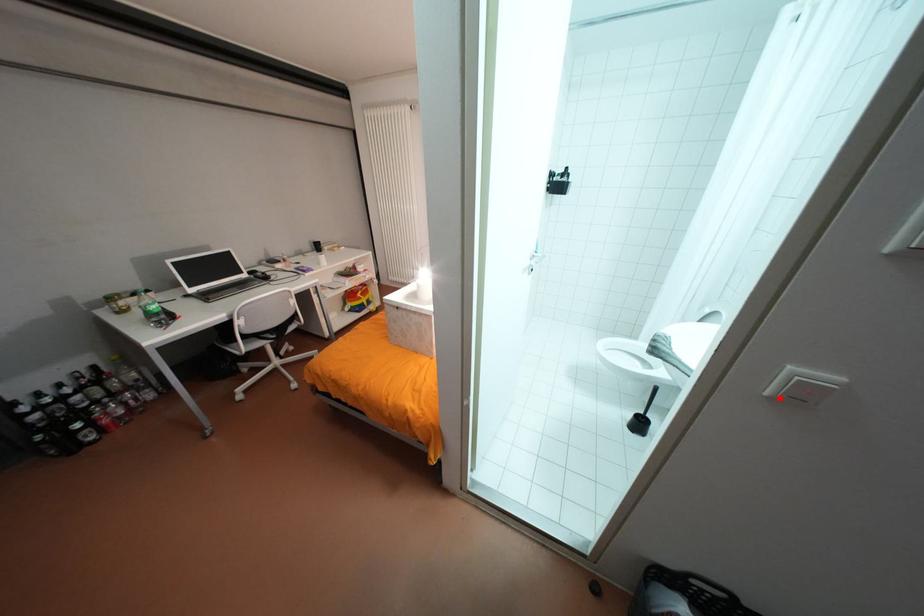
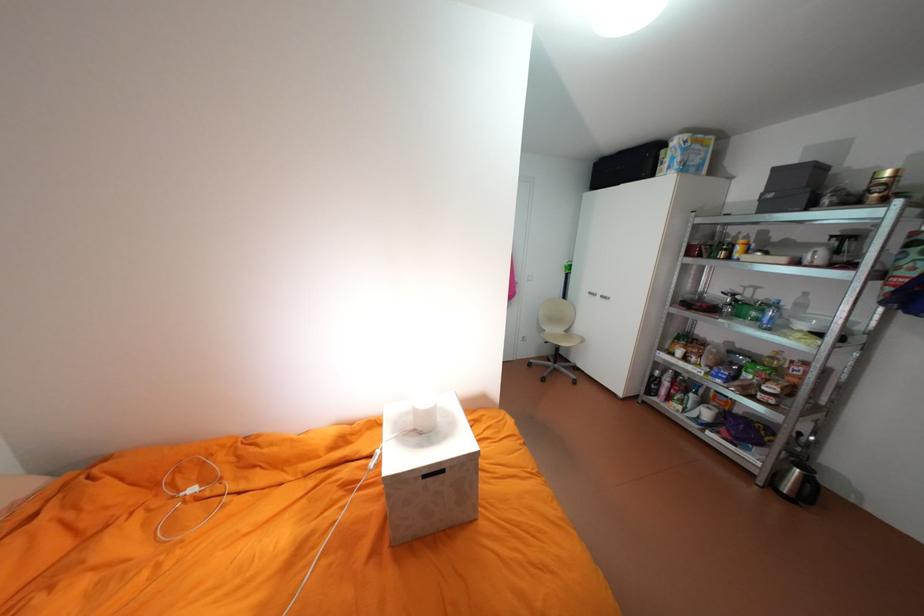
Question: I am providing you with two images of the same scene from different viewpoints. A red point is marked on the first image. Is the red point's position out of view in image 2?

Choices:
 (A) Yes
 (B) No

Answer: (A)